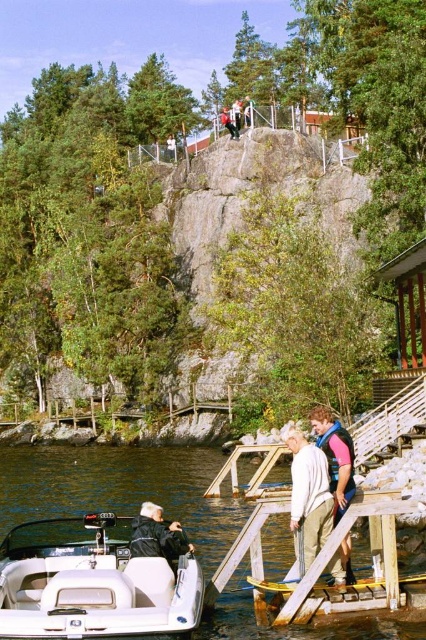
Can you confirm if wooden at lower center is taller than matte black jacket at upper center?

Incorrect, wooden at lower center's height is not larger of matte black jacket at upper center's.

At what (x,y) coordinates should I click in order to perform the action: click on wooden at lower center. Please return your answer as a coordinate pair (x, y). This screenshot has width=426, height=640. Looking at the image, I should click on (357, 579).

In order to click on wooden at lower center in this screenshot , I will do `click(357, 579)`.

Is point (141, 522) closer to viewer compared to point (221, 116)?

That is True.

Is point (161, 524) behind point (245, 113)?

No, (161, 524) is in front of (245, 113).

The height and width of the screenshot is (640, 426). I want to click on black leather jacket at lower center, so click(157, 536).

Between white matte boat at lower left and clear water at lower left, which one appears on the left side from the viewer's perspective?

clear water at lower left is more to the left.

Does white matte boat at lower left have a smaller size compared to clear water at lower left?

Indeed, white matte boat at lower left has a smaller size compared to clear water at lower left.

Between point (78, 609) and point (276, 536), which one is positioned behind?

Point (276, 536)

Where is `white matte boat at lower left`? white matte boat at lower left is located at coordinates (92, 586).